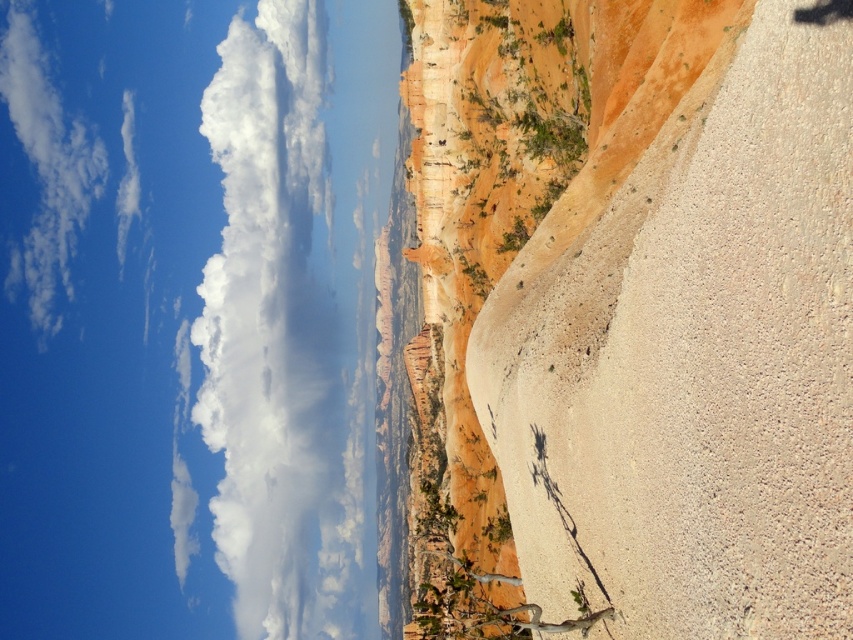
Can you confirm if rustic sandstone cliff at right is positioned to the left of white fluffy cloud at upper left?

No, rustic sandstone cliff at right is not to the left of white fluffy cloud at upper left.

Is rustic sandstone cliff at right positioned behind white fluffy cloud at upper left?

That is False.

I want to click on rustic sandstone cliff at right, so click(x=645, y=301).

The width and height of the screenshot is (853, 640). Find the location of `rustic sandstone cliff at right`. rustic sandstone cliff at right is located at coordinates (645, 301).